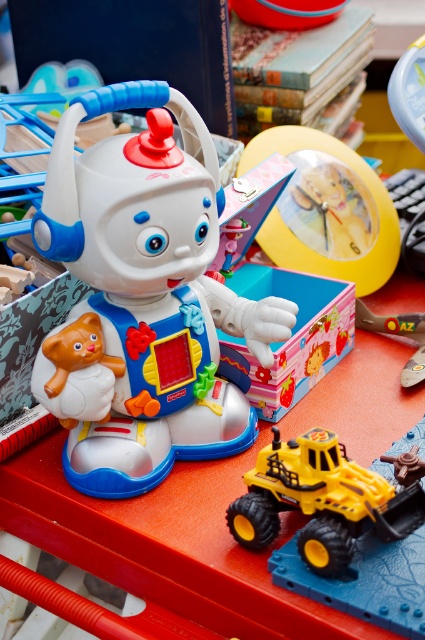
Can you confirm if plastic toy robot at center is wider than yellow plastic clock at center?

Correct, the width of plastic toy robot at center exceeds that of yellow plastic clock at center.

Between plastic toy robot at center and yellow plastic clock at center, which one has more height?

Standing taller between the two is plastic toy robot at center.

Identify the location of plastic toy robot at center. (142, 300).

How distant is yellow rubber toy truck at lower center from yellow plastic clock at center?

A distance of 20.34 inches exists between yellow rubber toy truck at lower center and yellow plastic clock at center.

Is yellow rubber toy truck at lower center taller than yellow plastic clock at center?

No.

Who is more distant from viewer, (413,460) or (308,154)?

The point (308,154) is more distant.

Find the location of a particular element. This screenshot has width=425, height=640. yellow rubber toy truck at lower center is located at coordinates (325, 499).

Does yellow rubber toy truck at lower center lie in front of matte plastic clock at center?

Yes, it is in front of matte plastic clock at center.

Find the location of a particular element. The image size is (425, 640). yellow rubber toy truck at lower center is located at coordinates (325, 499).

Describe the element at coordinates (325, 499) in the screenshot. I see `yellow rubber toy truck at lower center` at that location.

Locate an element on the screen. The width and height of the screenshot is (425, 640). yellow rubber toy truck at lower center is located at coordinates (325, 499).